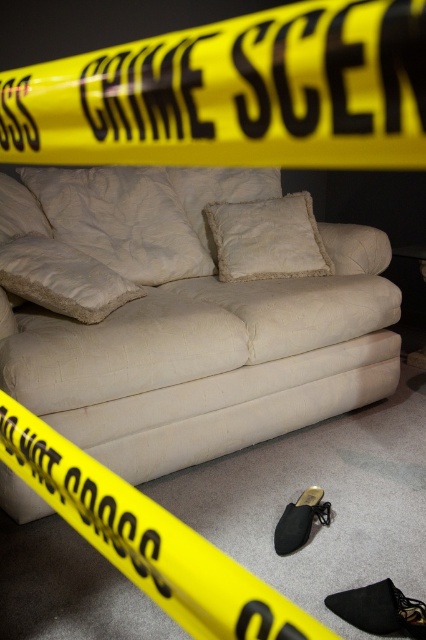
Looking at this image, you are a crime scene investigator who needs to document the position of the yellow plastic tape at lower center and the white fluffy pillow at center. Which object is positioned higher in the image?

The white fluffy pillow at center is positioned higher than the yellow plastic tape at lower center.

You are an investigator examining the crime scene. You notice two pillows on the sofa. Which pillow is located to the left of the other? The pillows are the white textured pillow at center and the fuzzy white pillow at center.

The white textured pillow at center is positioned on the left side of the fuzzy white pillow at center.

You are a forensic analyst examining the crime scene photo. The yellow plastic tape at lower center is crucial for determining the scene boundaries. Based on its position, can you estimate its coordinates in the image? Please provide the coordinates as a point in the format of x,y.

The yellow plastic tape at lower center is located at coordinates (147, 540).